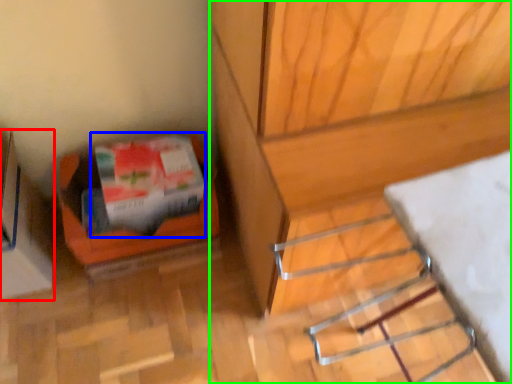
Question: Which is farther away from cardboard box (highlighted by a red box)? wrapping paper (highlighted by a blue box) or furniture (highlighted by a green box)?

Choices:
 (A) wrapping paper
 (B) furniture

Answer: (B)